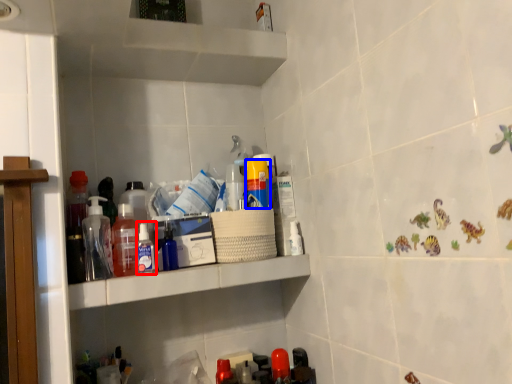
Question: Which object is closer to the camera taking this photo, toiletry (highlighted by a red box) or toiletry (highlighted by a blue box)?

Choices:
 (A) toiletry
 (B) toiletry

Answer: (A)